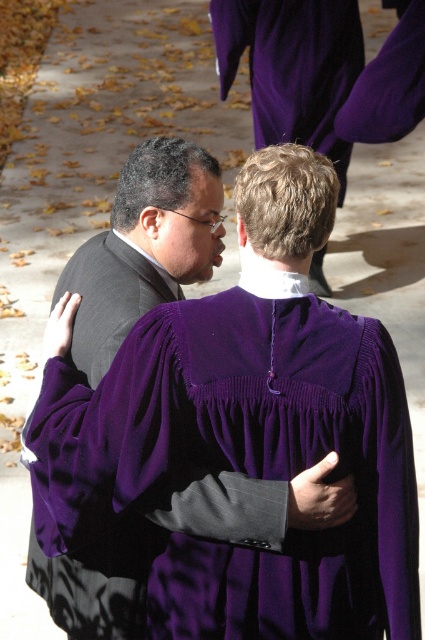
Measure the distance between point (235, 420) and camera.

A distance of 9.70 feet exists between point (235, 420) and camera.

Does purple velvet gown at center appear on the right side of velvet purple robe at center?

Indeed, purple velvet gown at center is positioned on the right side of velvet purple robe at center.

Who is more distant from viewer, (312, 339) or (181, 196)?

The point (181, 196) is more distant.

Where is `purple velvet gown at center`? Image resolution: width=425 pixels, height=640 pixels. purple velvet gown at center is located at coordinates (241, 464).